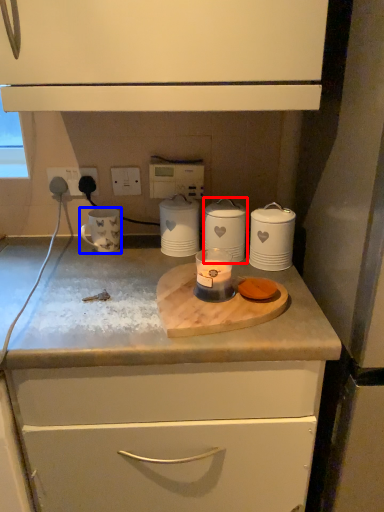
Question: Which of the following is the closest to the observer, home appliance (highlighted by a red box) or appliance (highlighted by a blue box)?

Choices:
 (A) home appliance
 (B) appliance

Answer: (A)